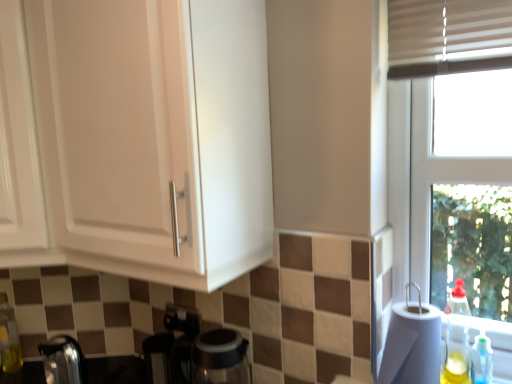
Question: Is there a large distance between white paper towel at right and translucent plastic soap dispenser at lower right, arranged as the 1th bottle when viewed from the right?

Choices:
 (A) yes
 (B) no

Answer: (B)

Question: Does white paper towel at right have a lesser height compared to translucent plastic soap dispenser at lower right, the 3th bottle positioned from the left?

Choices:
 (A) yes
 (B) no

Answer: (B)

Question: Is white paper towel at right closer to the viewer compared to translucent plastic soap dispenser at lower right, arranged as the 1th bottle when viewed from the right?

Choices:
 (A) yes
 (B) no

Answer: (A)

Question: From a real-world perspective, is white paper towel at right physically above translucent plastic soap dispenser at lower right, arranged as the third bottle when viewed from the back?

Choices:
 (A) no
 (B) yes

Answer: (B)

Question: From the image's perspective, is white paper towel at right located beneath translucent plastic soap dispenser at lower right, which appears as the 1th bottle when viewed from the front?

Choices:
 (A) yes
 (B) no

Answer: (B)

Question: Does point (230, 355) appear closer or farther from the camera than point (13, 114)?

Choices:
 (A) closer
 (B) farther

Answer: (B)

Question: Considering their positions, is transparent glass coffee machine at lower center located in front of or behind white glossy cabinet at upper left, the 2th cabinetry positioned from the right?

Choices:
 (A) behind
 (B) front

Answer: (A)

Question: Considering the positions of transparent glass coffee machine at lower center and white glossy cabinet at upper left, positioned as the first cabinetry in left-to-right order, in the image, is transparent glass coffee machine at lower center wider or thinner than white glossy cabinet at upper left, positioned as the first cabinetry in left-to-right order,?

Choices:
 (A) wide
 (B) thin

Answer: (B)

Question: Considering the positions of transparent glass coffee machine at lower center and white glossy cabinet at upper left, the 2th cabinetry positioned from the right, in the image, is transparent glass coffee machine at lower center bigger or smaller than white glossy cabinet at upper left, the 2th cabinetry positioned from the right,?

Choices:
 (A) big
 (B) small

Answer: (B)

Question: Which is correct: translucent glass bottle at lower left, the 1th bottle in the left-to-right sequence, is inside metallic stainless steel kettle at lower left, or outside of it?

Choices:
 (A) outside
 (B) inside

Answer: (A)

Question: Considering the positions of point (8, 329) and point (170, 342), is point (8, 329) closer or farther from the camera than point (170, 342)?

Choices:
 (A) farther
 (B) closer

Answer: (A)

Question: Considering the positions of translucent glass bottle at lower left, which ranks as the third bottle in front-to-back order, and metallic stainless steel kettle at lower left in the image, is translucent glass bottle at lower left, which ranks as the third bottle in front-to-back order, taller or shorter than metallic stainless steel kettle at lower left?

Choices:
 (A) short
 (B) tall

Answer: (B)

Question: Considering their positions, is translucent glass bottle at lower left, the 1th bottle from the back, located in front of or behind metallic stainless steel kettle at lower left?

Choices:
 (A) front
 (B) behind

Answer: (B)

Question: Considering the positions of point (0, 296) and point (42, 253), is point (0, 296) closer or farther from the camera than point (42, 253)?

Choices:
 (A) farther
 (B) closer

Answer: (A)

Question: Is translucent glass bottle at lower left, which ranks as the third bottle in right-to-left order, situated inside white matte cabinet at upper left, marked as the 2th cabinetry in a left-to-right arrangement, or outside?

Choices:
 (A) outside
 (B) inside

Answer: (A)